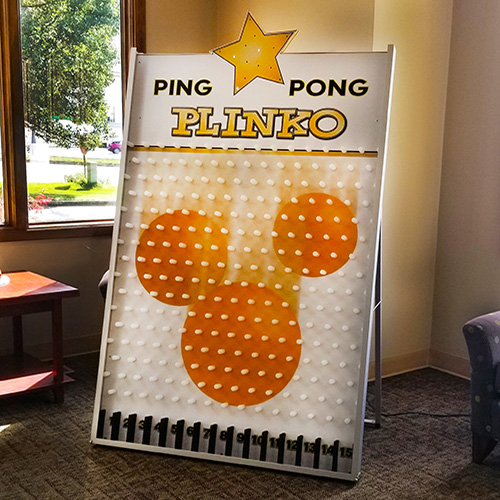
Locate an element on the screen. This screenshot has width=500, height=500. side table is located at coordinates pyautogui.click(x=25, y=284).